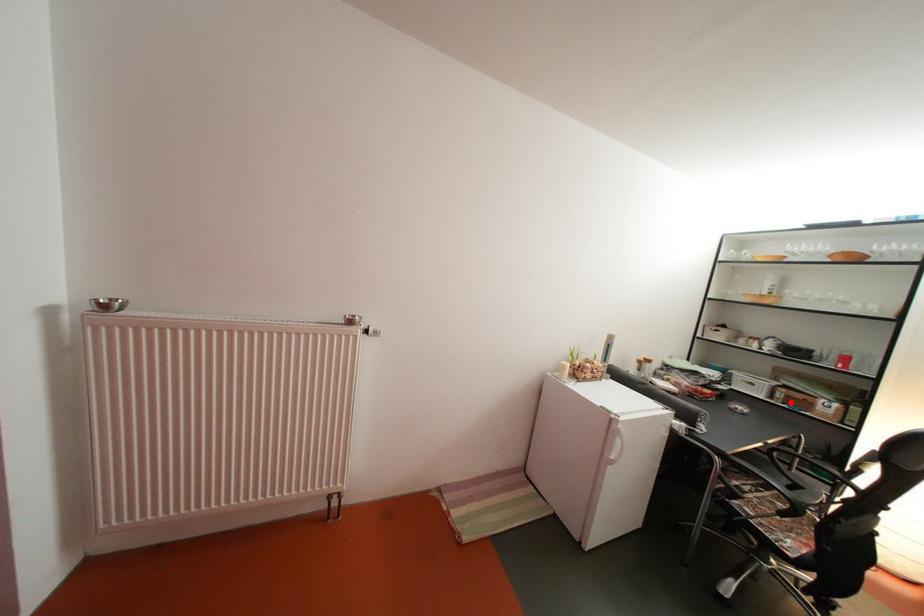
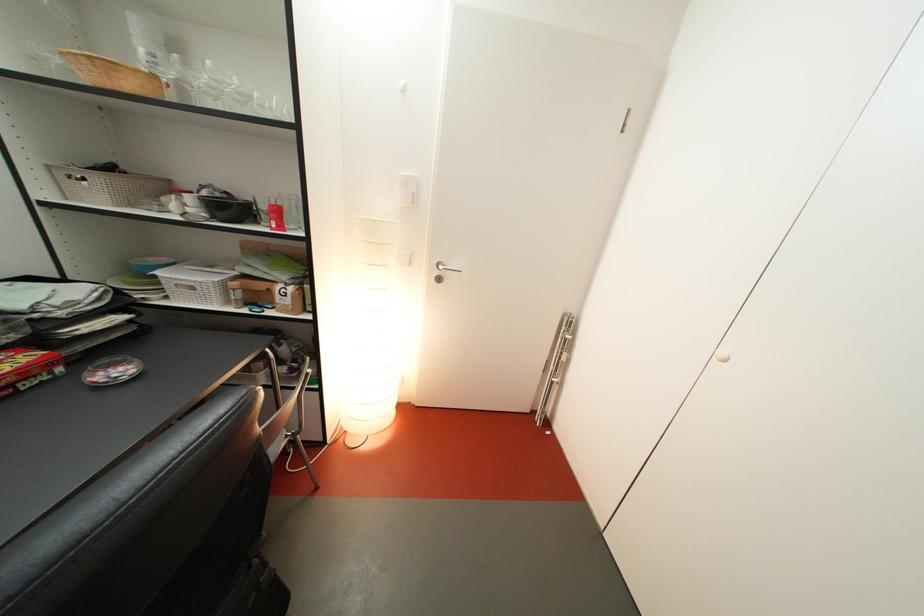
Locate, in the second image, the point that corresponds to the highlighted location in the first image.

(249, 301)